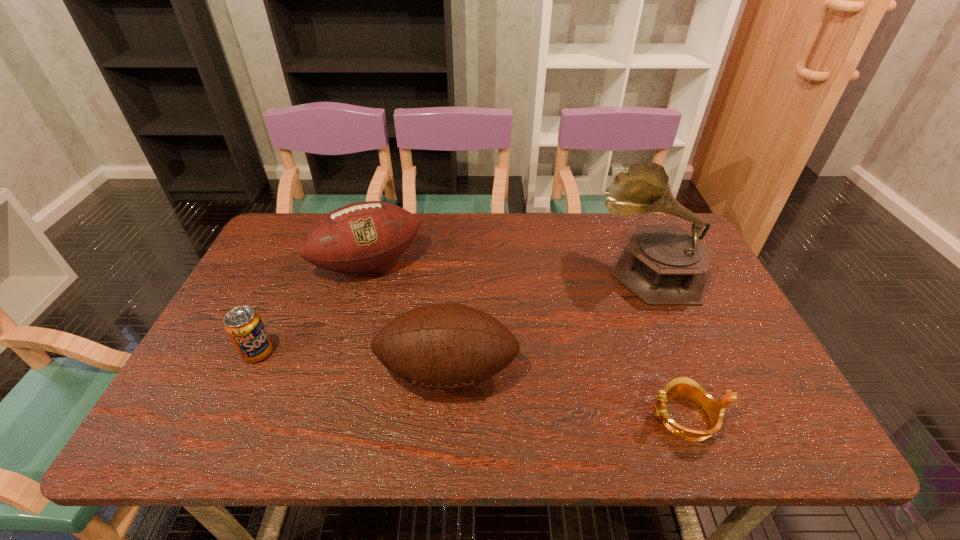
Locate an element on the screen. The height and width of the screenshot is (540, 960). tiara that is at the right edge is located at coordinates (681, 387).

Find the location of a particular element. The width and height of the screenshot is (960, 540). object located at the far right corner is located at coordinates (663, 265).

Find the location of a particular element. The width and height of the screenshot is (960, 540). object that is at the near right corner is located at coordinates (681, 387).

You are a GUI agent. You are given a task and a screenshot of the screen. Output one action in this format:
    pyautogui.click(x=<x>, y=<y>)
    Task: Click on the blank space at the far edge of the desktop
    This screenshot has height=540, width=960.
    Given the screenshot: What is the action you would take?
    pyautogui.click(x=610, y=241)

Where is `vacant space at the near edge`? The width and height of the screenshot is (960, 540). vacant space at the near edge is located at coordinates (594, 435).

This screenshot has width=960, height=540. In the image, there is a desktop. In order to click on free space at the left edge in this screenshot , I will do tap(216, 331).

Identify the location of empty space between the tallest object and the tiara. (668, 343).

Locate an element on the screen. vacant area that lies between the shortest object and the nearer football is located at coordinates (566, 395).

Locate an element on the screen. The height and width of the screenshot is (540, 960). vacant space that's between the leftmost object and the nearer football is located at coordinates (352, 362).

Locate an element on the screen. The height and width of the screenshot is (540, 960). free point between the shortest object and the tallest object is located at coordinates (668, 343).